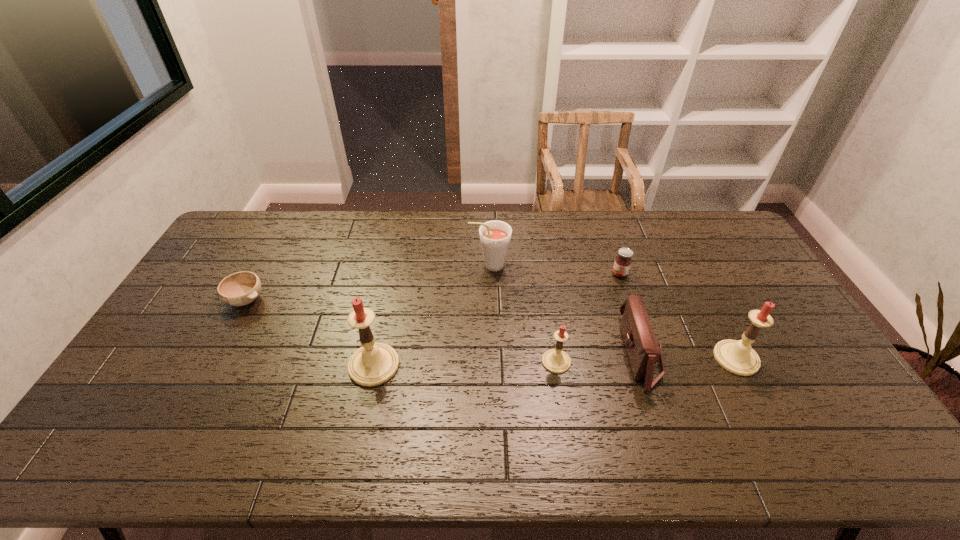
Find the location of a particular element. free location located 0.190m on the label side of the sixth tallest object is located at coordinates (556, 274).

Identify the location of free space located 0.360m on the label side of the sixth tallest object. This screenshot has height=540, width=960. (506, 274).

Identify the location of blank area located on the label side of the sixth tallest object. The width and height of the screenshot is (960, 540). (494, 274).

Locate an element on the screen. The height and width of the screenshot is (540, 960). object located in the near edge section of the desktop is located at coordinates (643, 349).

I want to click on object present at the left edge, so 241,288.

Where is `free space at the far edge of the desktop`? This screenshot has width=960, height=540. free space at the far edge of the desktop is located at coordinates (319, 229).

Locate an element on the screen. This screenshot has width=960, height=540. vacant space at the near edge of the desktop is located at coordinates (255, 400).

Find the location of a particular element. vacant space at the left edge is located at coordinates (203, 329).

What are the coordinates of `vacant space at the right edge of the desktop` in the screenshot? It's located at (780, 329).

This screenshot has height=540, width=960. In order to click on free space between the root beer and the rightmost candle in this screenshot , I will do `click(612, 312)`.